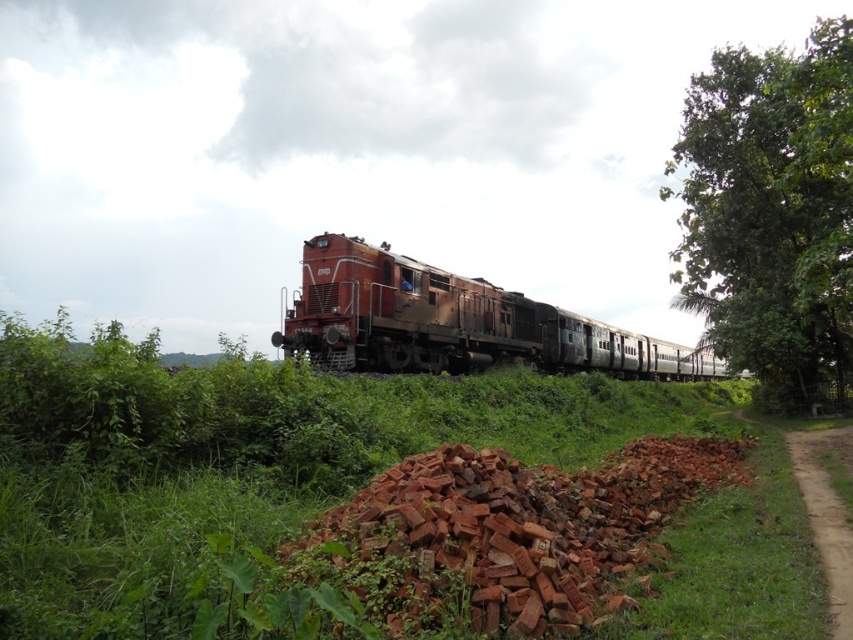
This screenshot has height=640, width=853. I want to click on brick rubble at lower center, so 508,532.

Which is behind, point (599, 480) or point (831, 547)?

Point (599, 480)

Does point (572, 493) come closer to viewer compared to point (838, 528)?

Yes, point (572, 493) is closer to viewer.

Identify the location of brick rubble at lower center. The image size is (853, 640). (508, 532).

Which is behind, point (770, 260) or point (379, 262)?

Positioned behind is point (770, 260).

Find the location of `green leafy tree at upper right`. green leafy tree at upper right is located at coordinates (772, 211).

Which is above, brick rubble at lower center or green leafy tree at upper right?

Positioned higher is green leafy tree at upper right.

Based on the photo, which is below, brick rubble at lower center or green leafy tree at upper right?

brick rubble at lower center is lower down.

Is point (668, 490) behind point (817, 385)?

No, (668, 490) is in front of (817, 385).

Where is `brick rubble at lower center`? brick rubble at lower center is located at coordinates (508, 532).